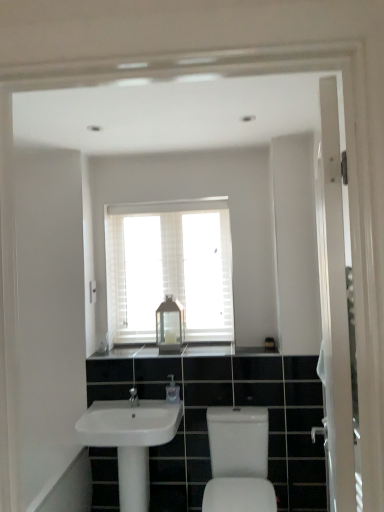
The image size is (384, 512). I want to click on free space to the left of clear plastic soap dispenser at center, so click(x=146, y=402).